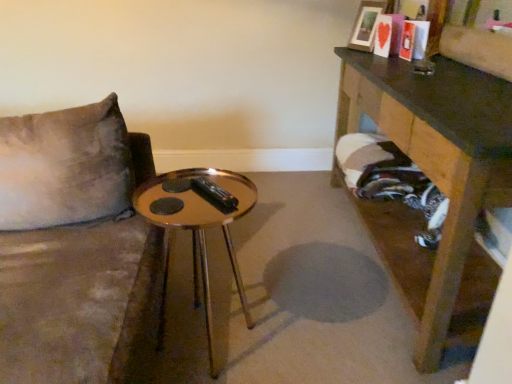
Locate an element on the screen. This screenshot has height=384, width=512. empty space that is ontop of wooden table at right, the 2th table from the left (from a real-world perspective) is located at coordinates (454, 79).